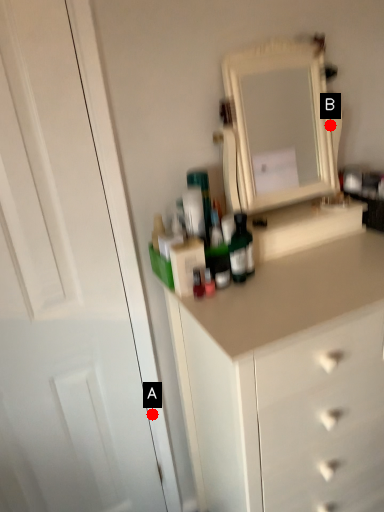
Question: Two points are circled on the image, labeled by A and B beside each circle. Which point is further to the camera?

Choices:
 (A) A is further
 (B) B is further

Answer: (A)